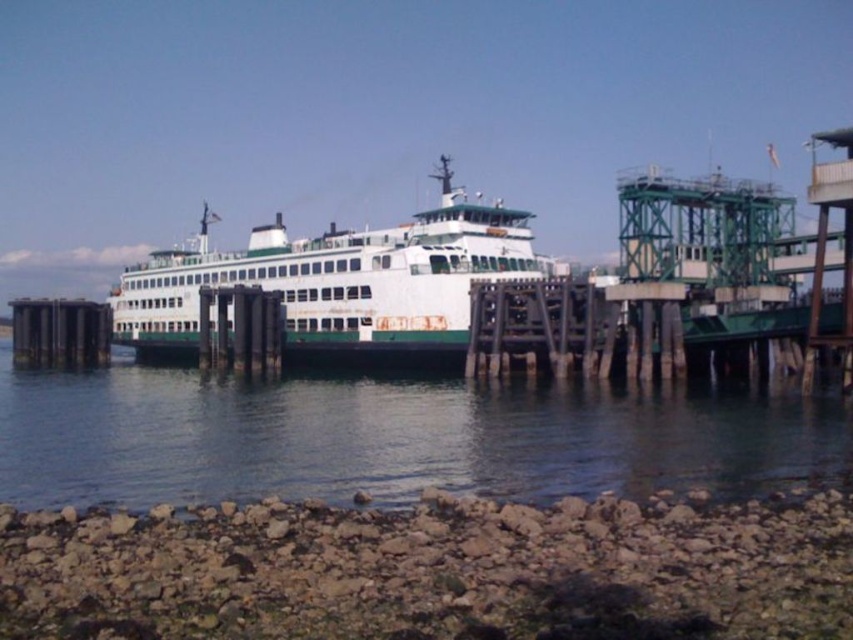
Question: Does clear water at center appear over white matte ferry at center?

Choices:
 (A) no
 (B) yes

Answer: (A)

Question: Among these objects, which one is nearest to the camera?

Choices:
 (A) white matte ferry at center
 (B) clear water at center

Answer: (B)

Question: Is clear water at center thinner than white matte ferry at center?

Choices:
 (A) no
 (B) yes

Answer: (A)

Question: Which point appears closest to the camera in this image?

Choices:
 (A) (86, 451)
 (B) (436, 358)

Answer: (A)

Question: Can you confirm if clear water at center is wider than white matte ferry at center?

Choices:
 (A) yes
 (B) no

Answer: (A)

Question: Which of the following is the farthest from the observer?

Choices:
 (A) (392, 349)
 (B) (743, 445)

Answer: (A)